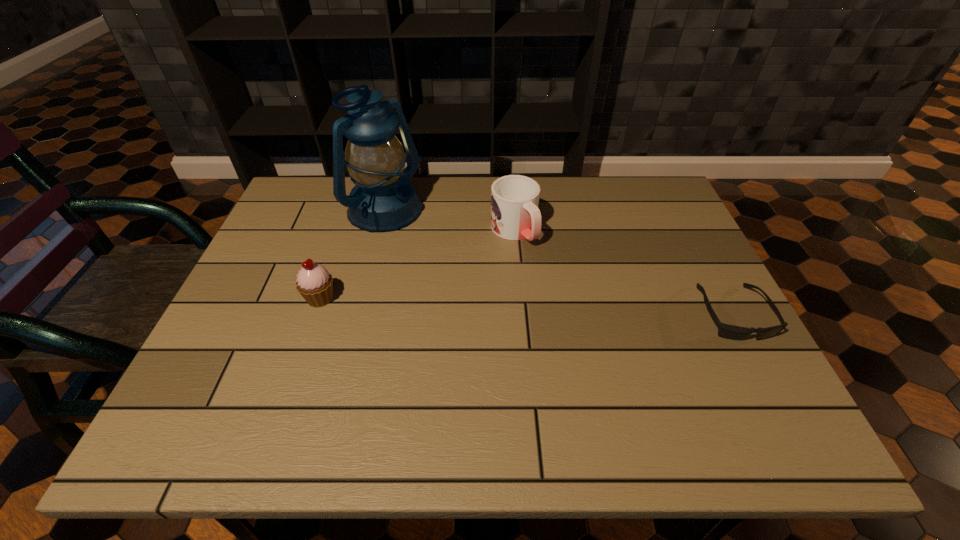
Locate an element on the screen. The width and height of the screenshot is (960, 540). vacant space on the desktop that is between the cupcake and the shortest object and is positioned on the face of the lantern is located at coordinates (515, 305).

Where is `free space on the desktop that is between the cupcake and the shortest object and is positioned on the side of the third object from left to right with the handle`? free space on the desktop that is between the cupcake and the shortest object and is positioned on the side of the third object from left to right with the handle is located at coordinates (582, 307).